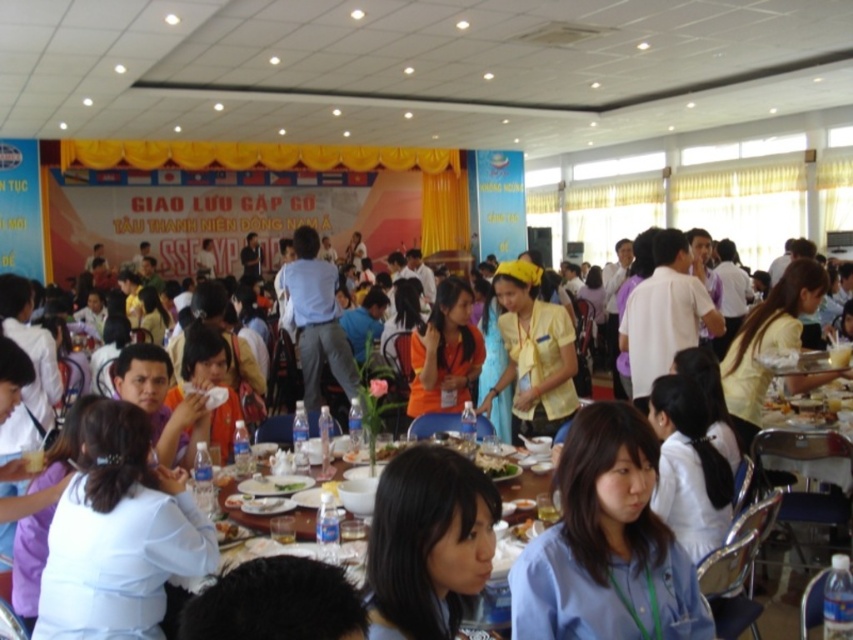
Which is below, white glossy table at center or white glossy plate at center?

Positioned lower is white glossy table at center.

Which is in front, point (354, 580) or point (489, 474)?

Point (354, 580) is more forward.

Locate an element on the screen. This screenshot has width=853, height=640. white glossy table at center is located at coordinates (281, 516).

Is white glossy table at center to the left of green leafy vegetable at center from the viewer's perspective?

In fact, white glossy table at center is to the right of green leafy vegetable at center.

Is point (305, 545) positioned before point (297, 476)?

Yes, it is.

Locate an element on the screen. white glossy table at center is located at coordinates (281, 516).

Is white glossy plate at center further to the viewer compared to green leafy vegetable at center?

Yes.

Measure the distance between white glossy plate at center and camera.

2.95 meters

At what (x,y) coordinates should I click in order to perform the action: click on white glossy plate at center. Please return your answer as a coordinate pair (x, y). Looking at the image, I should click on (495, 465).